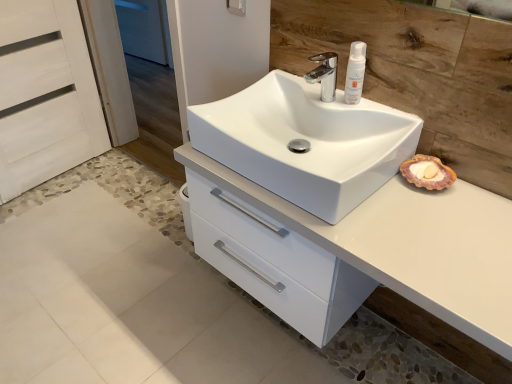
Identify the location of empty space that is ontop of white glossy cabinet at center (from a real-world perspective). This screenshot has height=384, width=512. (430, 226).